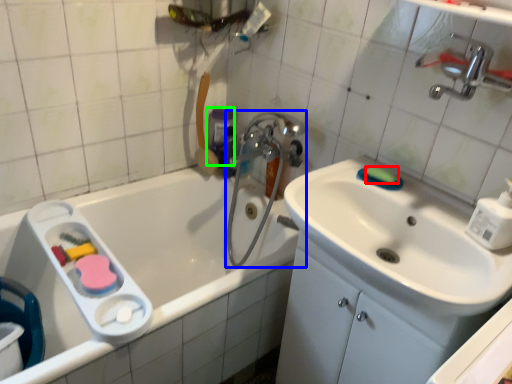
Question: Considering the real-world distances, which object is closest to soap (highlighted by a red box)? plumbing fixture (highlighted by a blue box) or mouthwash (highlighted by a green box).

Choices:
 (A) plumbing fixture
 (B) mouthwash

Answer: (A)